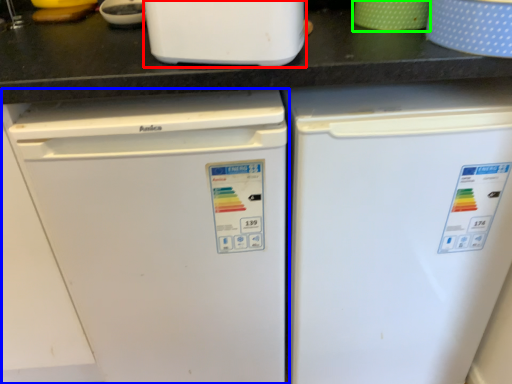
Question: Which object is the farthest from home appliance (highlighted by a red box)? Choose among these: refrigerator (highlighted by a blue box) or appliance (highlighted by a green box).

Choices:
 (A) refrigerator
 (B) appliance

Answer: (A)